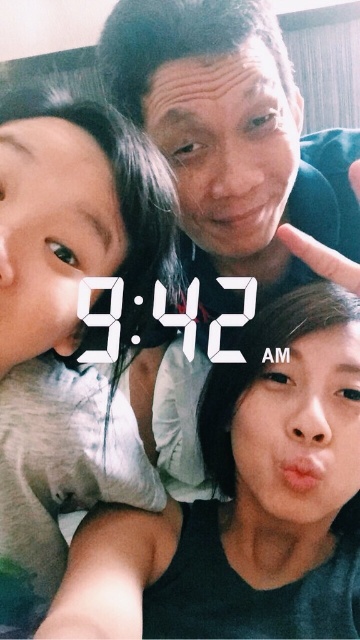
What do you see at coordinates (69, 326) in the screenshot?
I see `light beige fabric shirt at left` at bounding box center [69, 326].

Which is behind, point (164, 195) or point (219, 381)?

The point (219, 381) is more distant.

Does point (37, 472) come in front of point (189, 540)?

Yes, it is in front of point (189, 540).

Locate an element on the screen. This screenshot has width=360, height=640. light beige fabric shirt at left is located at coordinates (69, 326).

Can you confirm if black matte tank top at lower right is thinner than matte black shirt at center?

Yes.

Between point (293, 342) and point (343, 248), which one is positioned in front?

Point (293, 342) is in front.

At what (x,y) coordinates should I click in order to perform the action: click on black matte tank top at lower right. Please return your answer as a coordinate pair (x, y). Looking at the image, I should click on (236, 483).

Is light beige fabric shirt at left taller than matte black shirt at center?

In fact, light beige fabric shirt at left may be shorter than matte black shirt at center.

Who is more distant from viewer, (68, 417) or (358, 221)?

Point (358, 221)

Which is behind, point (82, 148) or point (186, 168)?

Point (186, 168)

Identify the location of light beige fabric shirt at left. pyautogui.click(x=69, y=326).